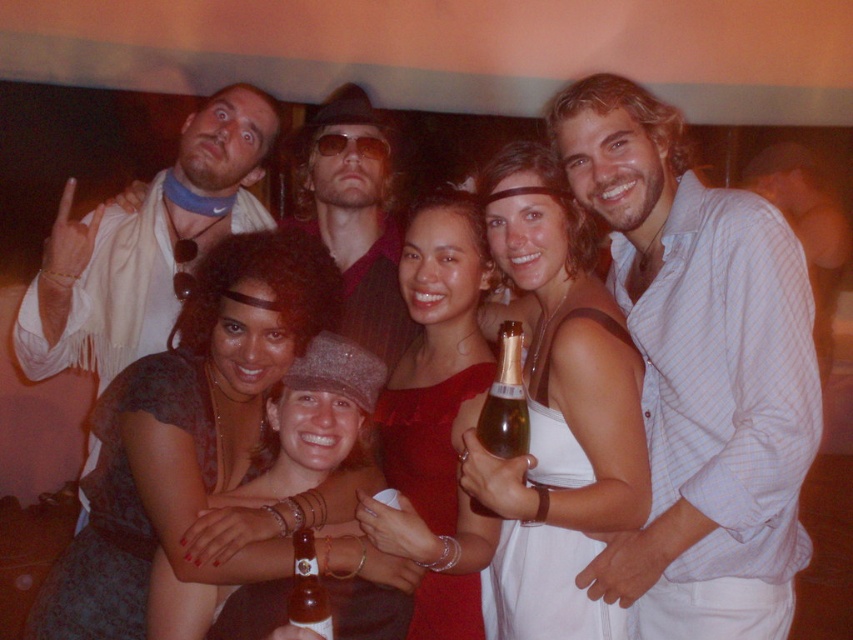
Which is more to the right, matte white scarf at left or sunglasses at center?

sunglasses at center is more to the right.

Is the position of matte white scarf at left more distant than that of sunglasses at center?

No.

Is point (105, 380) farther from camera compared to point (299, 211)?

No, it is in front of (299, 211).

Locate an element on the screen. The height and width of the screenshot is (640, 853). matte white scarf at left is located at coordinates [x=144, y=246].

Can you confirm if white fabric dress at center is bigger than dark brown textured dress at center?

Correct, white fabric dress at center is larger in size than dark brown textured dress at center.

You are a GUI agent. You are given a task and a screenshot of the screen. Output one action in this format:
    pyautogui.click(x=<x>, y=<y>)
    Task: Click on the white fabric dress at center
    The image size is (853, 640).
    Given the screenshot: What is the action you would take?
    pyautogui.click(x=556, y=412)

Can you confirm if white fabric dress at center is positioned below matte black dress at center?

No, white fabric dress at center is not below matte black dress at center.

Is point (500, 541) closer to viewer compared to point (152, 595)?

That is False.

This screenshot has height=640, width=853. I want to click on white fabric dress at center, so click(x=556, y=412).